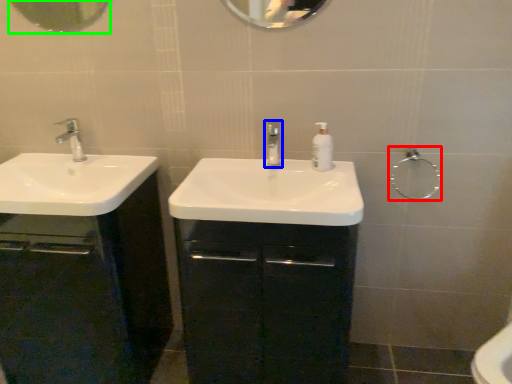
Question: Based on their relative distances, which object is nearer to shower (highlighted by a red box)? Choose from tap (highlighted by a blue box) and mirror (highlighted by a green box).

Choices:
 (A) tap
 (B) mirror

Answer: (A)